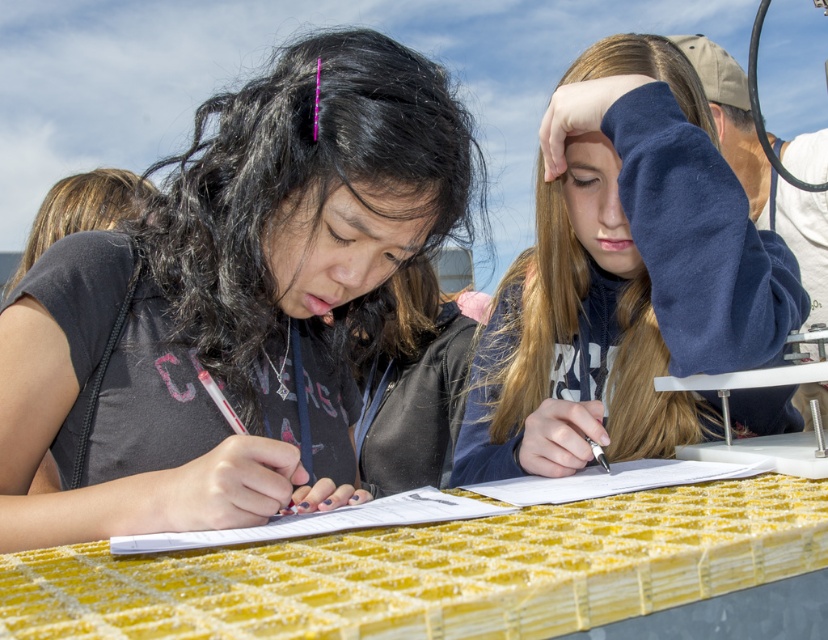
You are a photographer setting up for a portrait session. You need to ensure that the navy fleece hoodie at upper right and the yellow textured table at center are both in frame. Based on their positions, which object is located to the right of the other?

The navy fleece hoodie at upper right is positioned on the right side of yellow textured table at center, so the navy fleece hoodie at upper right is to the right of the yellow textured table at center.

You are a photographer trying to capture the matte black shirt at center and the yellow textured table at center in a single shot. Since the shirt is dark and the table is light, will you need to adjust your camera settings to balance the exposure for both objects?

The matte black shirt at center is positioned over yellow textured table at center, so the shirt will naturally block some light from the table. To balance exposure, you should adjust your camera settings to ensure both the dark shirt and the light table are properly lit in the photo.

You are a photographer taking a portrait of the two people at the table. You want to ensure the matte black shirt at center and the white paper at center are both clearly visible in the photo. Considering their sizes, which object might you need to adjust the camera angle to emphasize more?

The matte black shirt at center has a greater height compared to the white paper at center, so you might need to adjust the camera angle to emphasize the matte black shirt at center to ensure both are clearly visible.